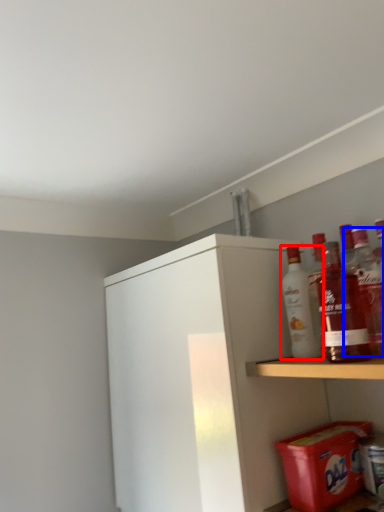
Question: Among these objects, which one is nearest to the camera, bottle (highlighted by a red box) or bottle (highlighted by a blue box)?

Choices:
 (A) bottle
 (B) bottle

Answer: (B)